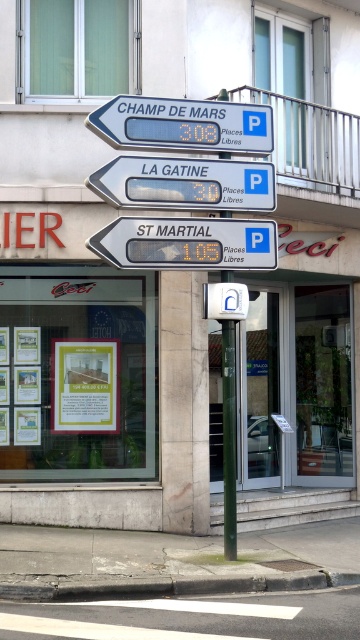
You are standing at the street corner and want to check the parking information. You notice a matte gray sign at center and a yellow paper at center. Which object is closer to you?

The matte gray sign at center is 7.42 feet away from the yellow paper at center, so the yellow paper at center is closer to you since it is positioned at the center and the distance between them is measured from your viewpoint.

You are a tourist standing at the street corner looking at the directional road signs. You notice the matte gray sign at center and the blue plastic sign at upper center. Which sign is closer to you?

The matte gray sign at center is closer to you because it is further to the viewer than the blue plastic sign at upper center, meaning it appears nearer in the scene.